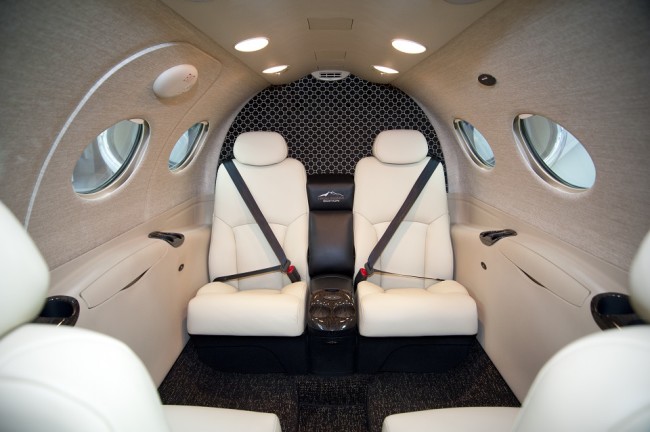
This screenshot has width=650, height=432. What are the coordinates of `space right under seat` in the screenshot? It's located at (424, 343).